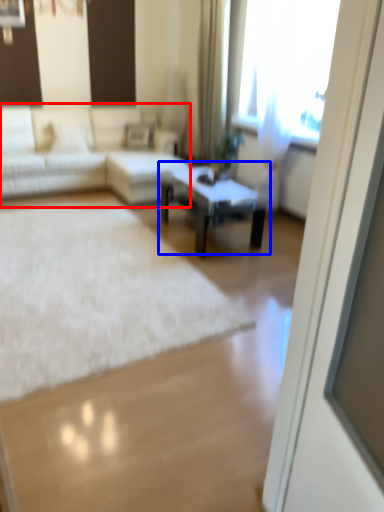
Question: Which object appears closest to the camera in this image, studio couch (highlighted by a red box) or coffee table (highlighted by a blue box)?

Choices:
 (A) studio couch
 (B) coffee table

Answer: (B)